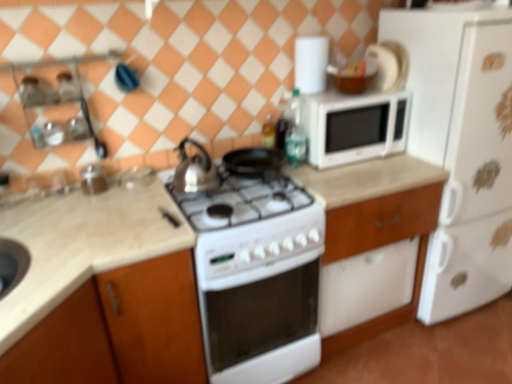
Question: From a real-world perspective, relative to transparent glass jar at upper left, positioned as the first appliance in bottom-to-top order, is translucent glass bottle at upper center, acting as the second bottle starting from the right, vertically above or below?

Choices:
 (A) above
 (B) below

Answer: (A)

Question: Is translucent glass bottle at upper center, acting as the second bottle starting from the right, bigger or smaller than transparent glass jar at upper left, the 2th appliance from the top?

Choices:
 (A) big
 (B) small

Answer: (B)

Question: Considering the real-world distances, which object is farthest from the silver metallic kettle at center?

Choices:
 (A) translucent glass bottle at upper center, which is the 1th bottle from left to right
 (B) white glossy microwave at upper right, arranged as the second appliance when viewed from the front
 (C) transparent glass jar at upper left, positioned as the first appliance in bottom-to-top order
 (D) beige marble countertop at lower left, positioned as the 1th countertop in left-to-right order
 (E) green glass bottle at upper right, acting as the first bottle starting from the right

Answer: (B)

Question: Which of these objects is positioned closest to the white matte refrigerator at right?

Choices:
 (A) translucent glass bottle at upper center, which is the 1th bottle from left to right
 (B) beige marble countertop at lower left, positioned as the 1th countertop in left-to-right order
 (C) white glossy microwave at upper right, arranged as the second appliance when viewed from the front
 (D) transparent glass jar at upper left, which appears as the second appliance when viewed from the right
 (E) beige marble countertop at center, the 2th countertop from the left

Answer: (C)